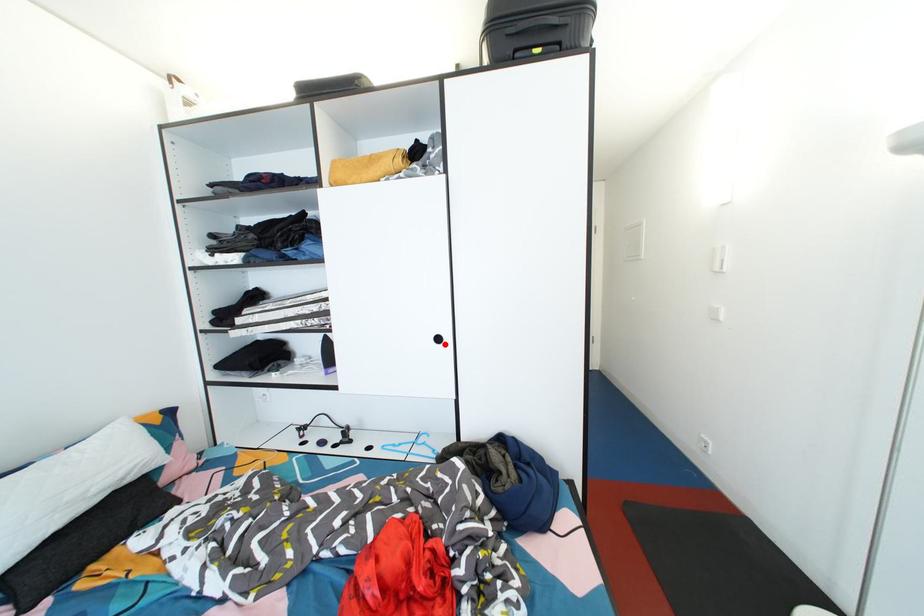
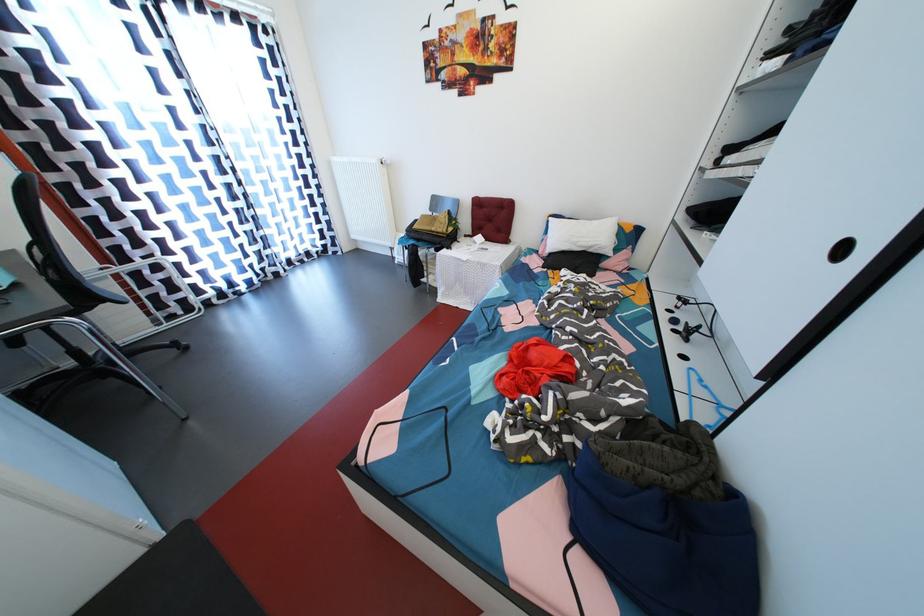
In the second image, find the point that corresponds to the highlighted location in the first image.

(848, 254)